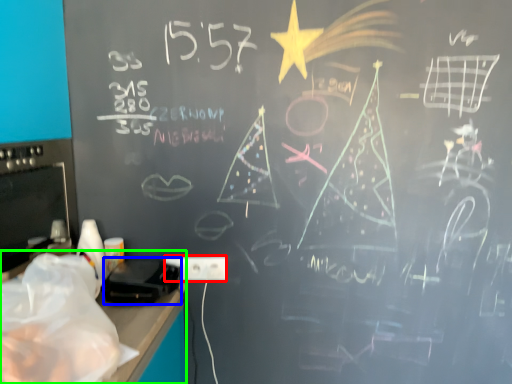
Question: Considering the real-world distances, which object is closest to electric outlet (highlighted by a red box)? equipment (highlighted by a blue box) or computer desk (highlighted by a green box).

Choices:
 (A) equipment
 (B) computer desk

Answer: (A)